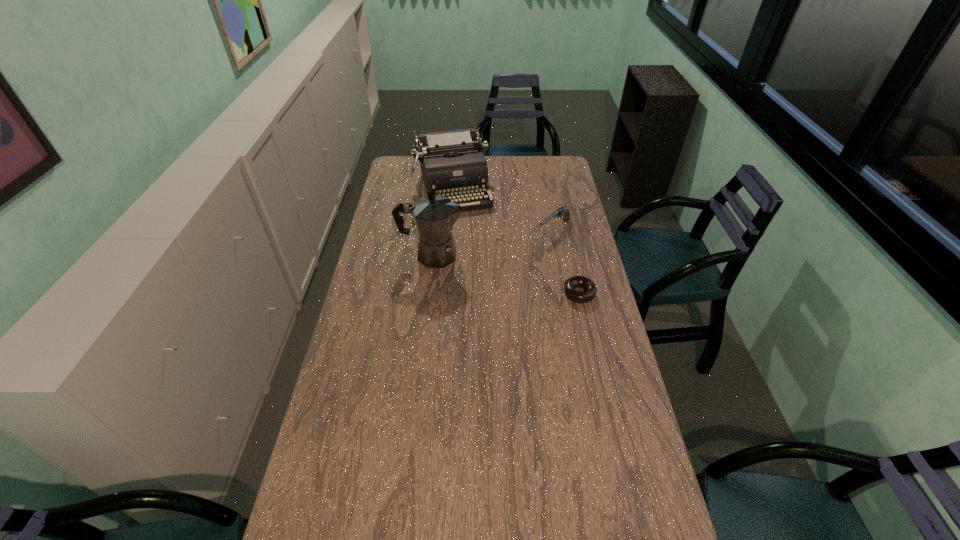
This screenshot has height=540, width=960. Find the location of `the third farthest object`. the third farthest object is located at coordinates (434, 216).

Find the location of a particular element. Image resolution: width=960 pixels, height=540 pixels. the tallest object is located at coordinates (434, 216).

Image resolution: width=960 pixels, height=540 pixels. Find the location of `the nearest object`. the nearest object is located at coordinates (574, 295).

Locate an element on the screen. doughnut is located at coordinates (574, 295).

Locate an element on the screen. gun is located at coordinates (561, 211).

Where is `typewriter`? This screenshot has height=540, width=960. typewriter is located at coordinates (452, 162).

Where is `vacant area situated 0.390m on the pouring side of the tallest object`? The width and height of the screenshot is (960, 540). vacant area situated 0.390m on the pouring side of the tallest object is located at coordinates (563, 255).

The width and height of the screenshot is (960, 540). In order to click on vacant space located on the back of the shortest object in this screenshot , I will do `click(574, 269)`.

Find the location of a particular element. The width and height of the screenshot is (960, 540). vacant region located aiming along the barrel of the gun is located at coordinates (481, 285).

The image size is (960, 540). I want to click on free space located aiming along the barrel of the gun, so click(498, 272).